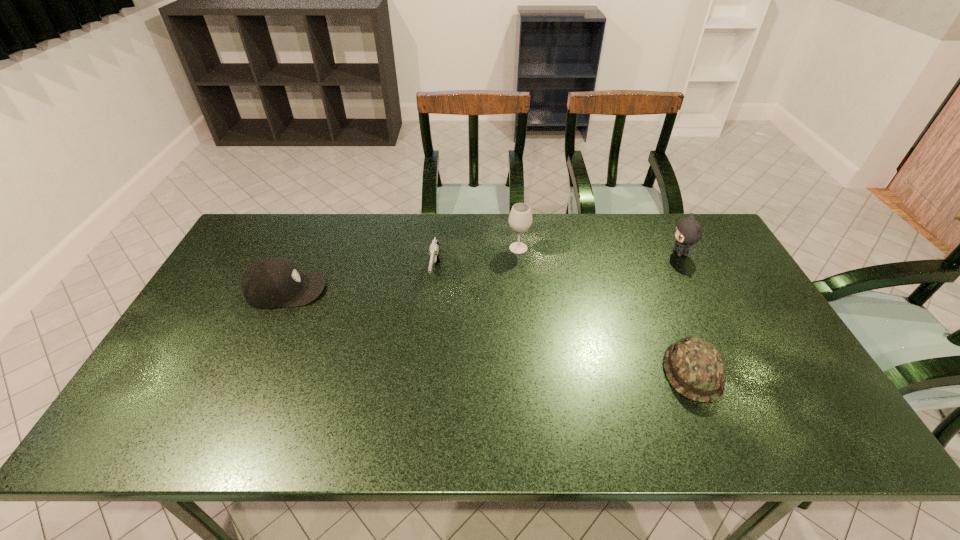
The image size is (960, 540). I want to click on object that is at the far right corner, so click(x=688, y=231).

Identify the location of vacant area at the far edge. (289, 247).

Identify the location of vacant area at the near edge. This screenshot has height=540, width=960. coord(636,426).

In the image, there is a desktop. At what (x,y) coordinates should I click in order to perform the action: click on free space at the left edge. Please return your answer as a coordinate pair (x, y). The height and width of the screenshot is (540, 960). Looking at the image, I should click on (x=240, y=303).

In the image, there is a desktop. Where is `vacant space at the right edge`? vacant space at the right edge is located at coordinates (698, 295).

Find the location of a particular element. The image size is (960, 540). vacant region at the far right corner of the desktop is located at coordinates (669, 222).

Where is `free region at the near right corner of the desktop`? This screenshot has width=960, height=540. free region at the near right corner of the desktop is located at coordinates (823, 416).

Where is `empty location between the taller headwear and the wineglass`? The height and width of the screenshot is (540, 960). empty location between the taller headwear and the wineglass is located at coordinates (402, 269).

At what (x,y) coordinates should I click in order to perform the action: click on vacant space that's between the left headwear and the gun. Please return your answer as a coordinate pair (x, y). The image size is (960, 540). Looking at the image, I should click on (361, 282).

Locate an element on the screen. This screenshot has height=540, width=960. vacant area between the taller headwear and the right headwear is located at coordinates (490, 331).